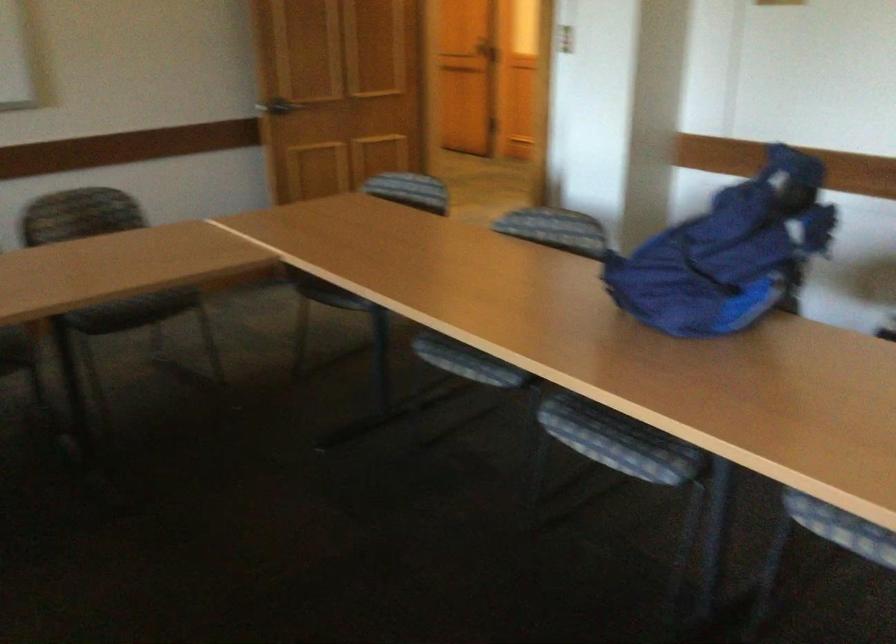
I want to click on silver door handle, so click(x=277, y=106).